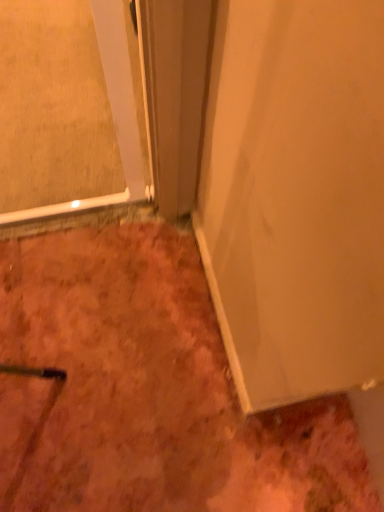
Question: Considering their positions, is clear glass door at upper left located in front of or behind white matte door at center?

Choices:
 (A) behind
 (B) front

Answer: (A)

Question: In terms of width, does clear glass door at upper left look wider or thinner when compared to white matte door at center?

Choices:
 (A) wide
 (B) thin

Answer: (A)

Question: Which is farther from the white matte door at center?

Choices:
 (A) dull orange carpet at lower left
 (B) clear glass door at upper left

Answer: (A)

Question: Estimate the real-world distances between objects in this image. Which object is closer to the dull orange carpet at lower left?

Choices:
 (A) white matte door at center
 (B) clear glass door at upper left

Answer: (A)